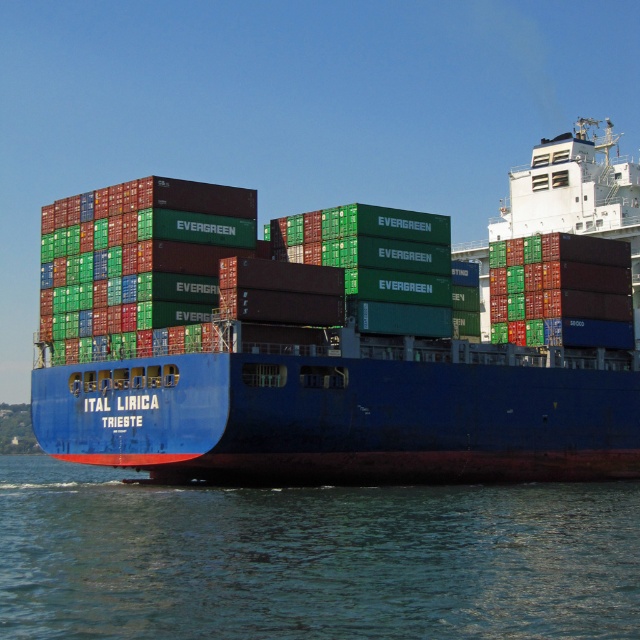
Based on the photo, is blue matte container ship at center smaller than blue water at lower center?

No, blue matte container ship at center is not smaller than blue water at lower center.

Does point (422, 387) come in front of point (224, 502)?

No, (422, 387) is further to viewer.

Identify the location of blue matte container ship at center. (339, 358).